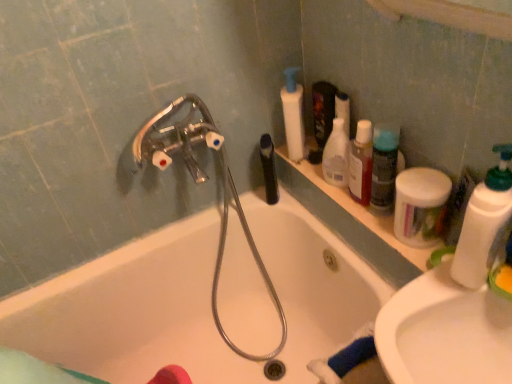
Question: Is white glossy sink at lower right inside white plastic bottle at right, the 5th cleaning product positioned from the back?

Choices:
 (A) yes
 (B) no

Answer: (B)

Question: From the image's perspective, is white plastic bottle at right, the 1th cleaning product in the front-to-back sequence, on top of white glossy sink at lower right?

Choices:
 (A) yes
 (B) no

Answer: (A)

Question: Considering the relative sizes of white plastic bottle at right, the 1th cleaning product in the front-to-back sequence, and white glossy sink at lower right in the image provided, is white plastic bottle at right, the 1th cleaning product in the front-to-back sequence, thinner than white glossy sink at lower right?

Choices:
 (A) no
 (B) yes

Answer: (B)

Question: Is white plastic bottle at right, the 5th cleaning product positioned from the back, oriented towards white glossy sink at lower right?

Choices:
 (A) no
 (B) yes

Answer: (A)

Question: Does white plastic bottle at right, the 5th cleaning product positioned from the back, have a greater width compared to white glossy sink at lower right?

Choices:
 (A) yes
 (B) no

Answer: (B)

Question: Considering the positions of translucent plastic bottle at upper right, the 2th mouthwash viewed from the back, and white glossy sink at lower right in the image, is translucent plastic bottle at upper right, the 2th mouthwash viewed from the back, bigger or smaller than white glossy sink at lower right?

Choices:
 (A) small
 (B) big

Answer: (A)

Question: Is point (368, 203) closer or farther from the camera than point (411, 309)?

Choices:
 (A) farther
 (B) closer

Answer: (A)

Question: From the image's perspective, is translucent plastic bottle at upper right, which is the first mouthwash from right to left, positioned above or below white glossy sink at lower right?

Choices:
 (A) above
 (B) below

Answer: (A)

Question: Is translucent plastic bottle at upper right, the 2th mouthwash viewed from the back, taller or shorter than white glossy sink at lower right?

Choices:
 (A) tall
 (B) short

Answer: (A)

Question: In terms of height, does metallic silver garden hose at upper left look taller or shorter compared to black matte bottle at upper center, the 2th mouthwash when ordered from front to back?

Choices:
 (A) short
 (B) tall

Answer: (B)

Question: From the image's perspective, is metallic silver garden hose at upper left above or below black matte bottle at upper center, the first mouthwash when ordered from left to right?

Choices:
 (A) above
 (B) below

Answer: (B)

Question: From a real-world perspective, relative to black matte bottle at upper center, the first mouthwash when ordered from left to right, is metallic silver garden hose at upper left vertically above or below?

Choices:
 (A) below
 (B) above

Answer: (A)

Question: Relative to black matte bottle at upper center, the 2th mouthwash when ordered from front to back, is metallic silver garden hose at upper left in front or behind?

Choices:
 (A) front
 (B) behind

Answer: (A)

Question: Is white ceramic bathtub at center in front of or behind white glossy sink at lower right in the image?

Choices:
 (A) front
 (B) behind

Answer: (B)

Question: Is white ceramic bathtub at center bigger or smaller than white glossy sink at lower right?

Choices:
 (A) small
 (B) big

Answer: (B)